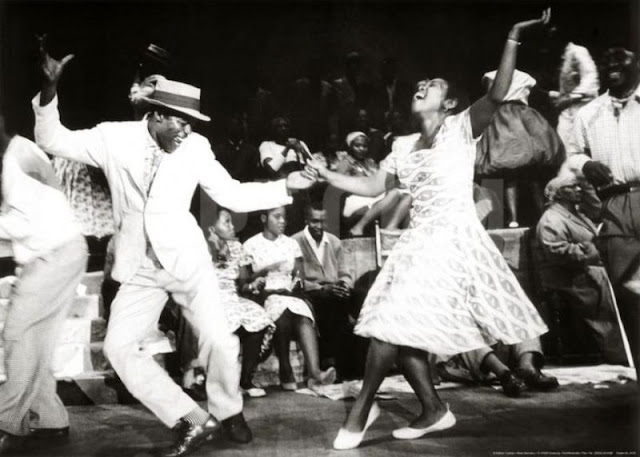
Identify the location of chair. (401, 228).